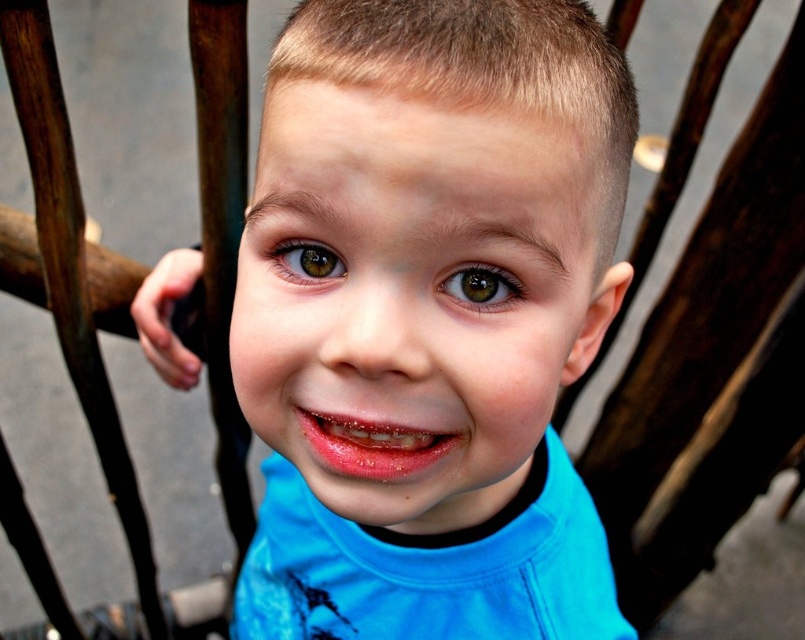
Measure the distance between point (556, 454) and camera.

Point (556, 454) is 24.33 inches away from camera.

Who is more forward, (353, 616) or (6, 289)?

Positioned in front is point (353, 616).

Who is more forward, [364,412] or [114,264]?

Point [364,412] is in front.

You are a GUI agent. You are given a task and a screenshot of the screen. Output one action in this format:
    pyautogui.click(x=<x>, y=<y>)
    Task: Click on the blue fabric shirt at center
    This screenshot has width=805, height=640.
    Given the screenshot: What is the action you would take?
    pyautogui.click(x=431, y=314)

Does point (473, 276) come farther from viewer compared to point (287, 268)?

No, it is not.

Is green matte eye at center wider than brown glossy eye at center?

Indeed, green matte eye at center has a greater width compared to brown glossy eye at center.

Is point (469, 266) farther from camera compared to point (312, 253)?

No, it is not.

Find the location of a particular element. This screenshot has height=640, width=805. green matte eye at center is located at coordinates (481, 285).

Who is taller, blue fabric shirt at center or green matte eye at center?

blue fabric shirt at center is taller.

Can you confirm if blue fabric shirt at center is positioned above green matte eye at center?

Incorrect, blue fabric shirt at center is not positioned above green matte eye at center.

Is point (354, 60) farther from camera compared to point (473, 273)?

No.

Locate an element on the screen. The image size is (805, 640). blue fabric shirt at center is located at coordinates (431, 314).